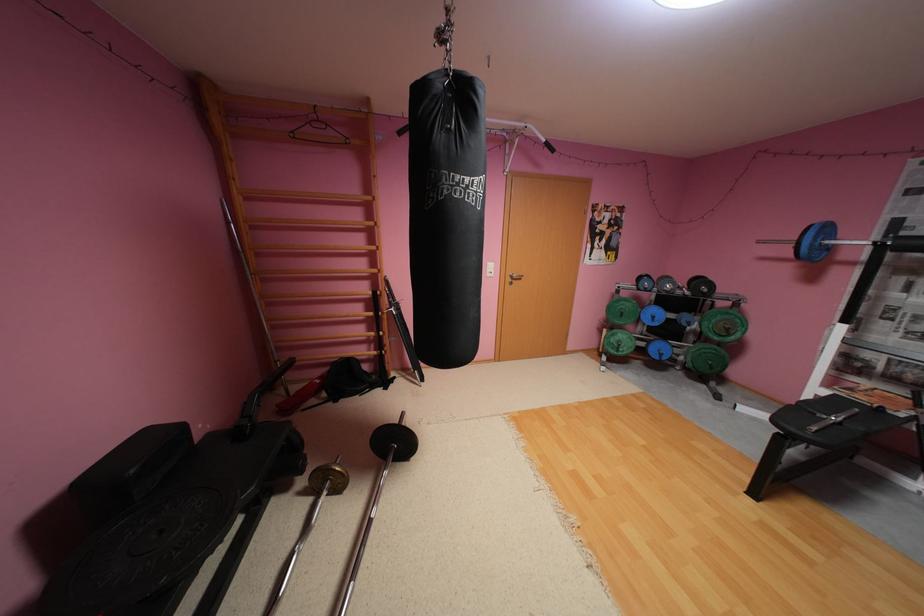
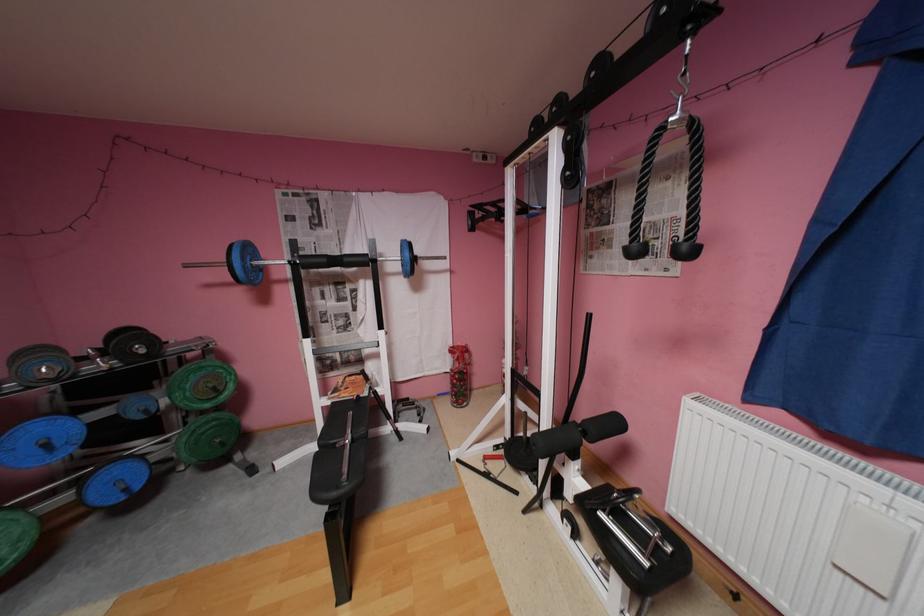
Locate, in the second image, the point that corresponds to (x=670, y=355) in the first image.

(134, 488)